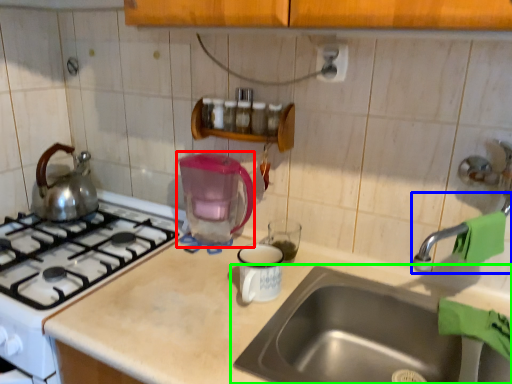
Question: Estimate the real-world distances between objects in this image. Which object is farther from coffeepot (highlighted by a red box), faucet (highlighted by a blue box) or sink (highlighted by a green box)?

Choices:
 (A) faucet
 (B) sink

Answer: (A)